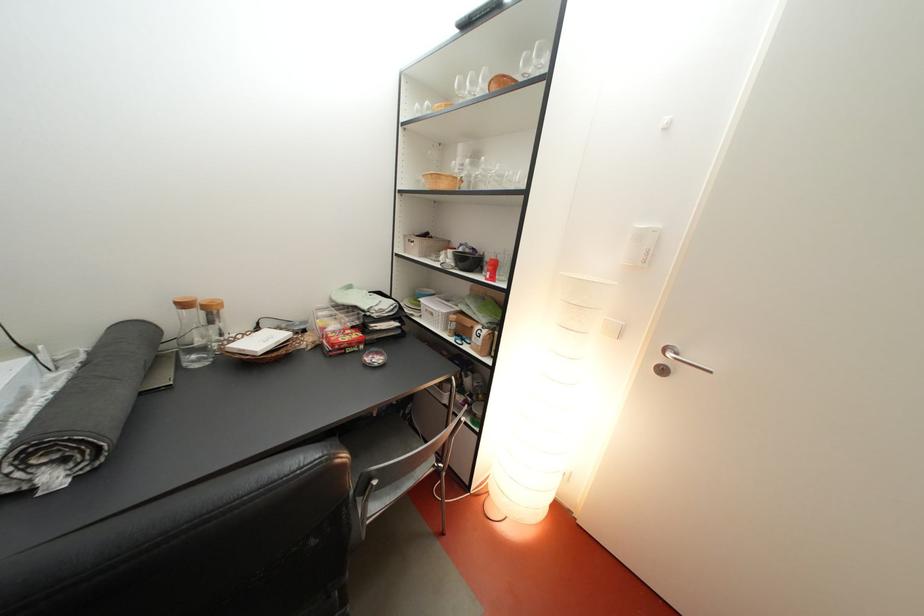
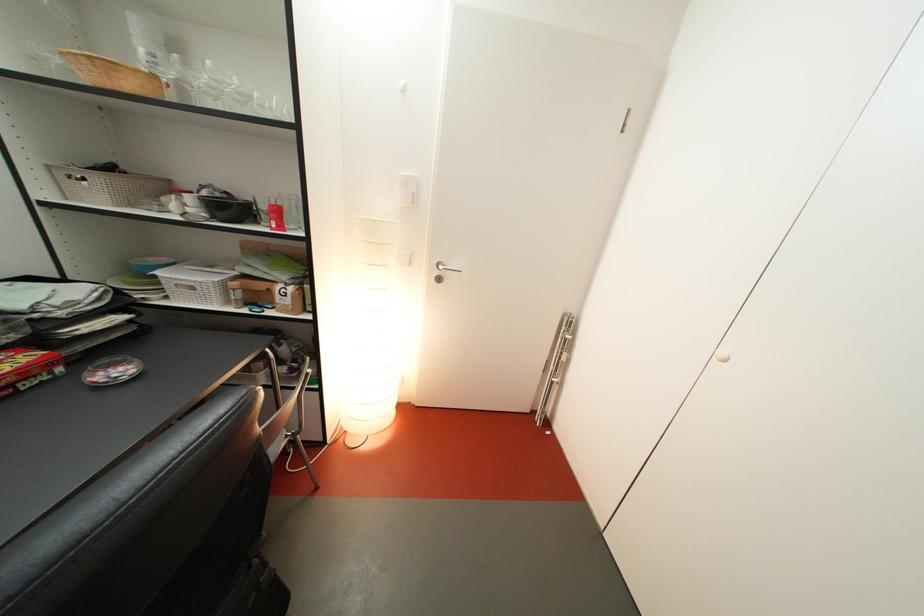
Question: I am providing you with two images of the same scene from different viewpoints. After the viewpoint changes to image2, which objects are now occluded?

Choices:
 (A) chair sitting surface
 (B) wicker basket
 (C) white cabinet knob
 (D) none of these

Answer: (D)